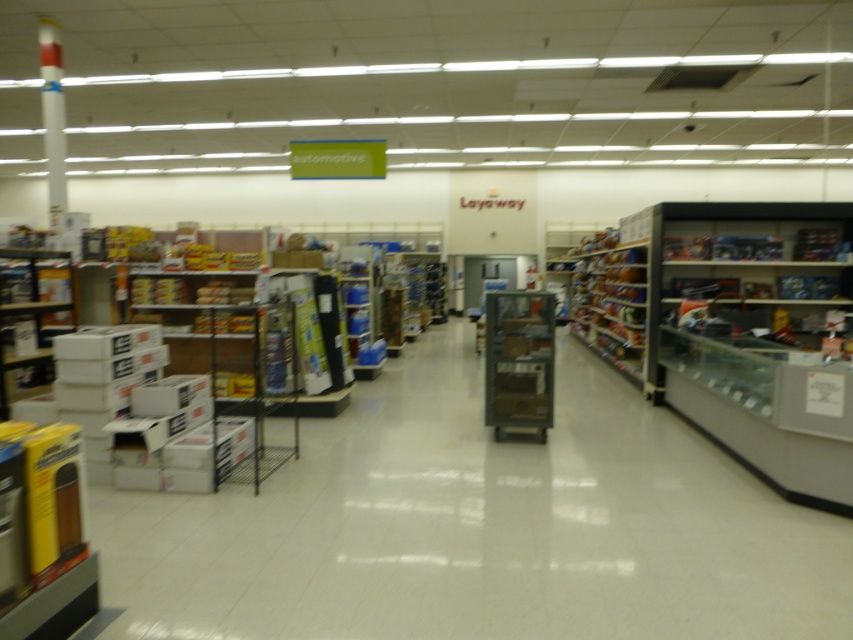
Is point (485, 404) more distant than point (634, 369)?

No, (485, 404) is closer to viewer.

Is point (529, 396) closer to viewer compared to point (616, 257)?

Yes, it is in front of point (616, 257).

Image resolution: width=853 pixels, height=640 pixels. Identify the location of metallic silver shelf at center. (518, 360).